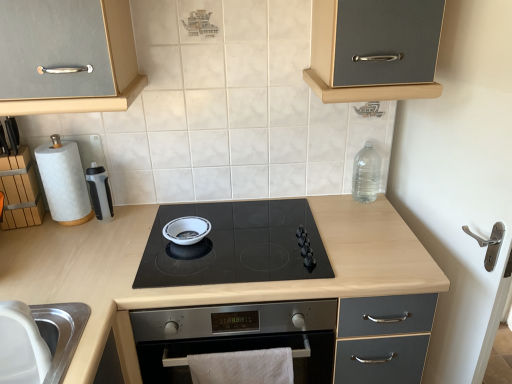
Question: Does white cotton towel at lower center have a greater height compared to wooden block at left?

Choices:
 (A) yes
 (B) no

Answer: (B)

Question: Is white cotton towel at lower center at the left side of wooden block at left?

Choices:
 (A) yes
 (B) no

Answer: (B)

Question: Does white cotton towel at lower center appear on the right side of wooden block at left?

Choices:
 (A) yes
 (B) no

Answer: (A)

Question: Is white cotton towel at lower center closer to the viewer compared to wooden block at left?

Choices:
 (A) no
 (B) yes

Answer: (B)

Question: Is white cotton towel at lower center touching wooden block at left?

Choices:
 (A) no
 (B) yes

Answer: (A)

Question: From a real-world perspective, does white cotton towel at lower center stand above wooden block at left?

Choices:
 (A) no
 (B) yes

Answer: (A)

Question: Is clear plastic bottle at upper right inside wooden block at left?

Choices:
 (A) no
 (B) yes

Answer: (A)

Question: Is wooden block at left turned away from clear plastic bottle at upper right?

Choices:
 (A) yes
 (B) no

Answer: (B)

Question: Is the depth of wooden block at left less than that of clear plastic bottle at upper right?

Choices:
 (A) no
 (B) yes

Answer: (B)

Question: Does wooden block at left have a larger size compared to clear plastic bottle at upper right?

Choices:
 (A) yes
 (B) no

Answer: (A)

Question: Considering the relative sizes of wooden block at left and clear plastic bottle at upper right in the image provided, is wooden block at left smaller than clear plastic bottle at upper right?

Choices:
 (A) yes
 (B) no

Answer: (B)

Question: Considering the relative sizes of wooden block at left and clear plastic bottle at upper right in the image provided, is wooden block at left taller than clear plastic bottle at upper right?

Choices:
 (A) yes
 (B) no

Answer: (A)

Question: Is white cotton towel at lower center taller than white glossy bowl at center?

Choices:
 (A) no
 (B) yes

Answer: (B)